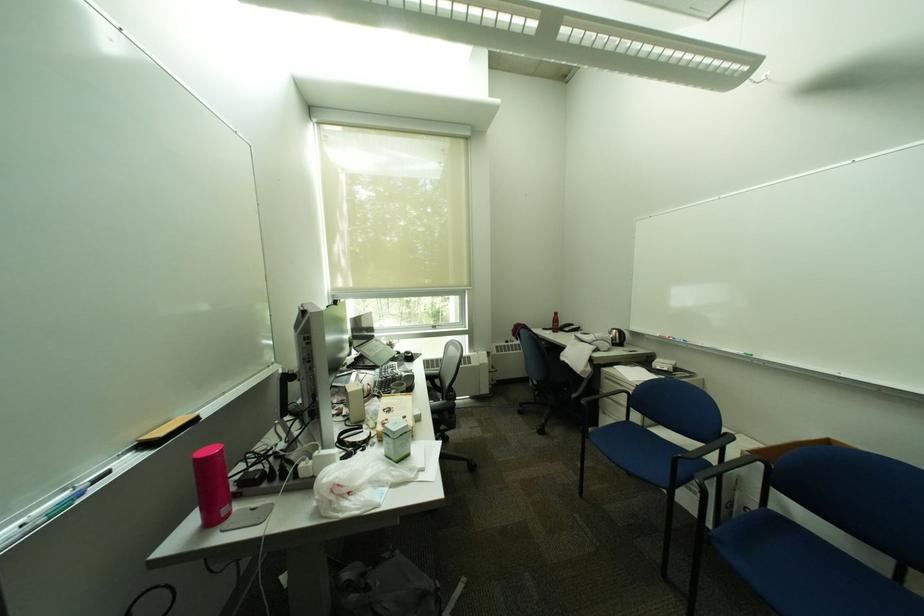
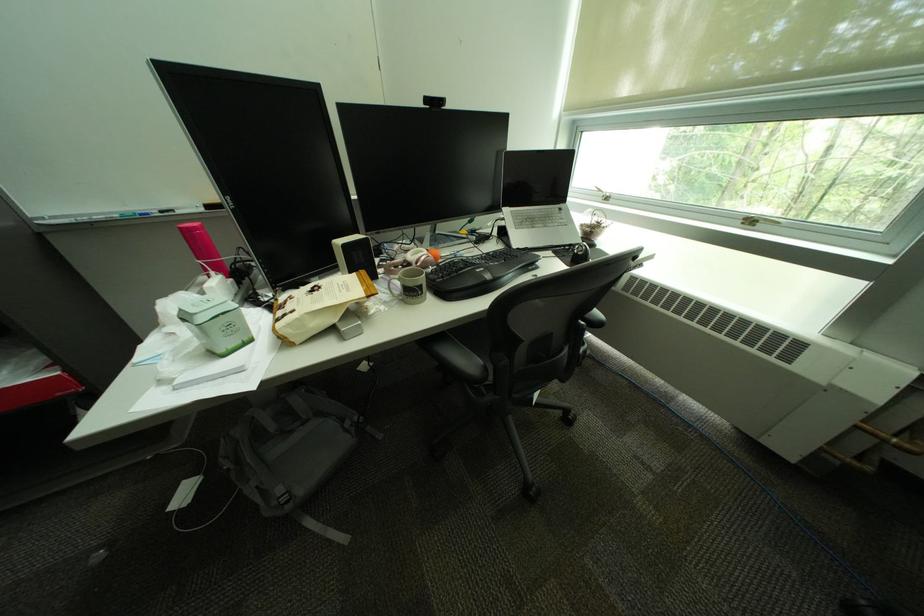
In the second image, find the point that corresponds to the point at 445,328 in the first image.

(761, 224)